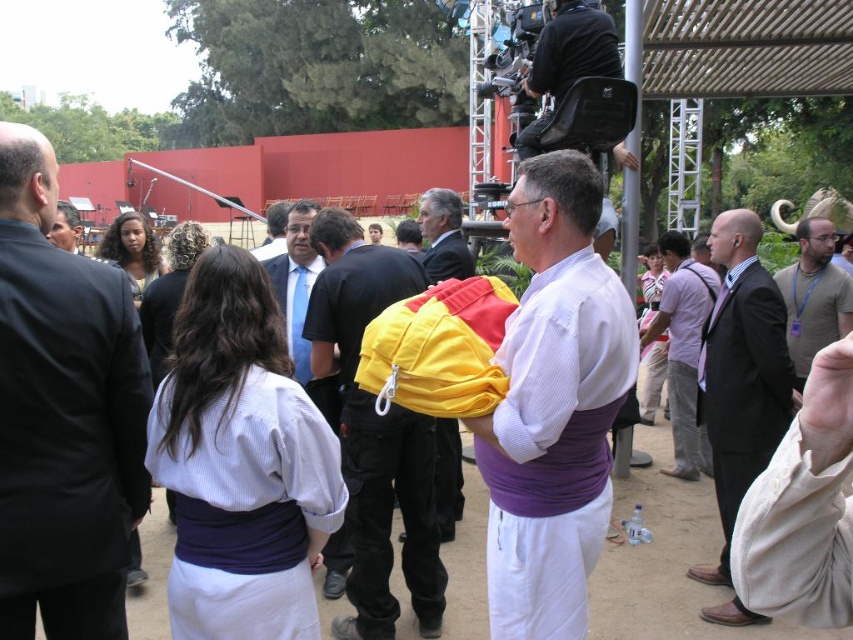
You are a photographer at the event who needs to capture a photo of the black suit at left and the yellow fabric jacket at center together in the frame. The camera you are using has a maximum focus range of 3 meters. Can you include both subjects in the same photo without moving the camera?

The black suit at left is 3.54 meters from the yellow fabric jacket at center. Since the distance between them exceeds the camera maximum focus range of 3 meters, you cannot include both subjects in the same photo without moving the camera.

You are standing at the origin point of the image coordinate system. The origin is at the bottom left corner of the image. You need to locate the light purple shirt at center. What are its coordinates?

The coordinates of the light purple shirt at center are at point (683, 348).